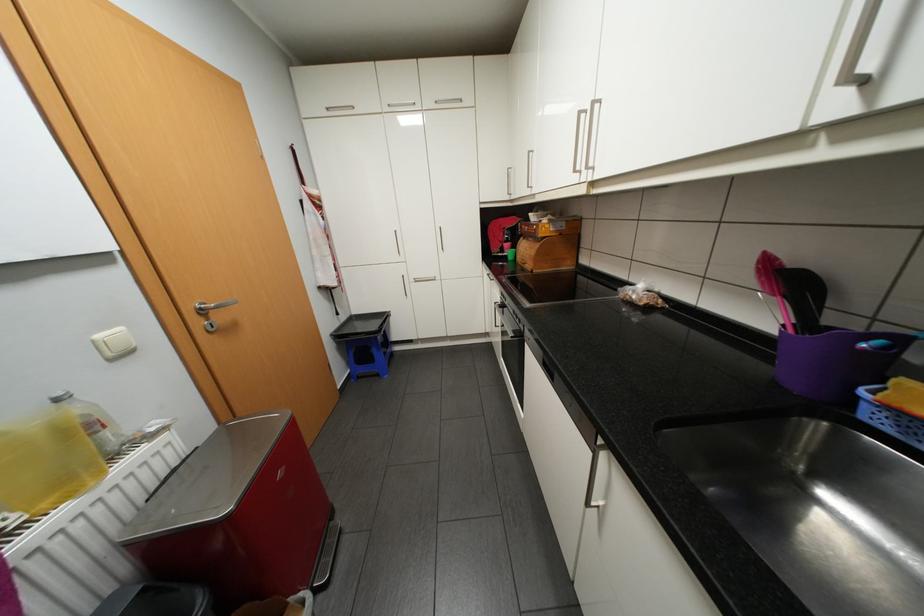
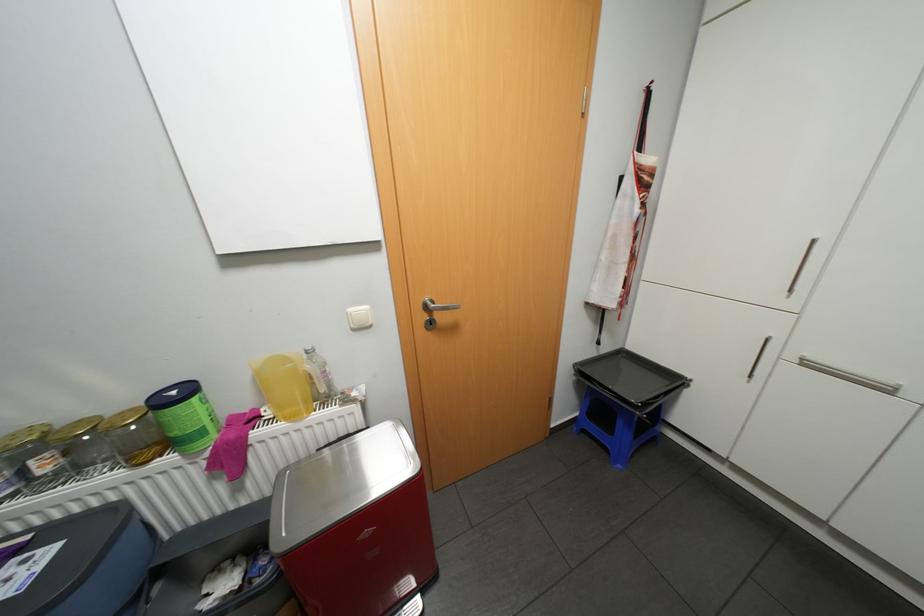
In the second image, find the point that corresponds to (x=392, y=315) in the first image.

(684, 379)